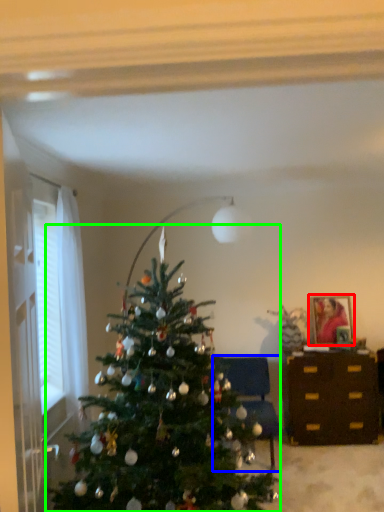
Question: Which is farther away from picture frame (highlighted by a red box)? furniture (highlighted by a blue box) or christmas tree (highlighted by a green box)?

Choices:
 (A) furniture
 (B) christmas tree

Answer: (B)